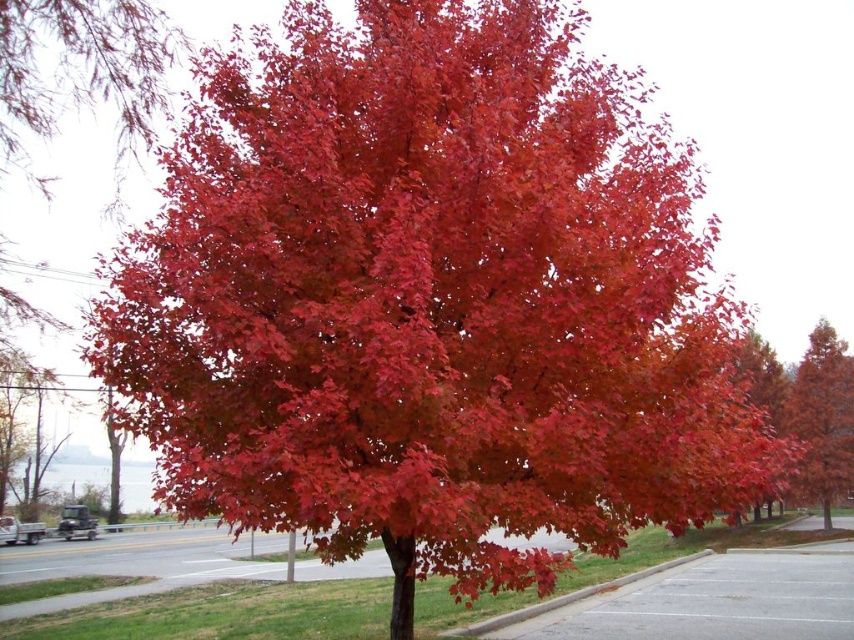
Is glossy red maple at center shorter than gray asphalt curb at lower right?

No, glossy red maple at center is not shorter than gray asphalt curb at lower right.

Looking at this image, between glossy red maple at center and gray asphalt curb at lower right, which one has less height?

gray asphalt curb at lower right

Does point (822, 404) lie behind point (685, 563)?

That is True.

Where is `glossy red maple at center`? glossy red maple at center is located at coordinates (822, 419).